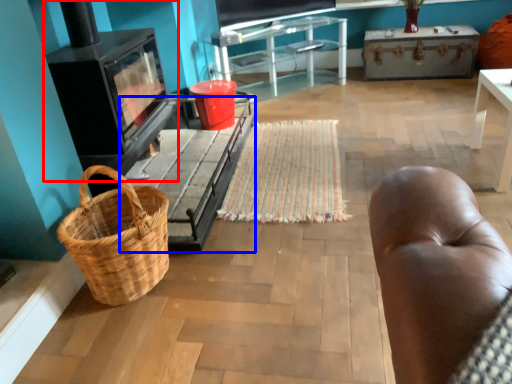
Question: Which object appears farthest to the camera in this image, stove (highlighted by a red box) or table (highlighted by a blue box)?

Choices:
 (A) stove
 (B) table

Answer: (B)